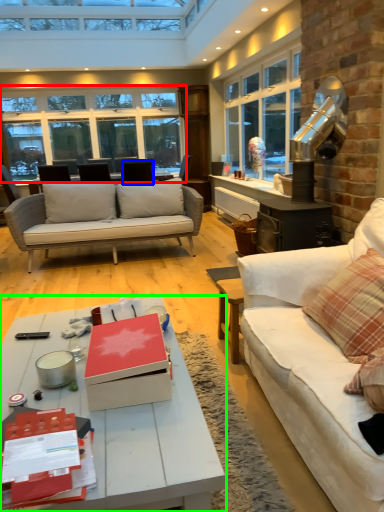
Question: Which is farther away from window (highlighted by a red box)? chair (highlighted by a blue box) or coffee table (highlighted by a green box)?

Choices:
 (A) chair
 (B) coffee table

Answer: (B)